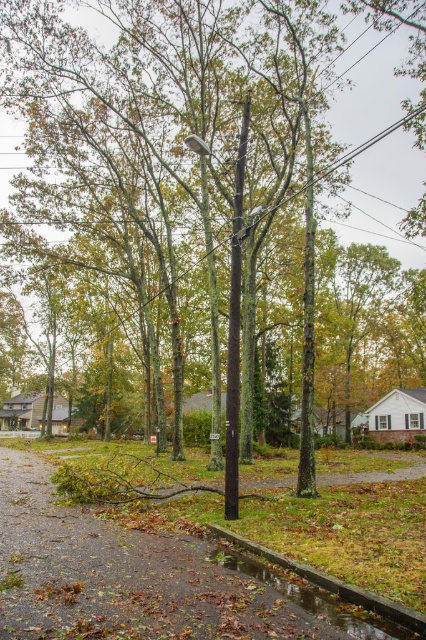
Is shiny reflective puddle at lower center bigger than metallic rectangular sign at center?

Actually, shiny reflective puddle at lower center might be smaller than metallic rectangular sign at center.

Does point (284, 595) come farther from viewer compared to point (215, 435)?

No.

Does point (308, 602) come closer to viewer compared to point (213, 436)?

Yes, point (308, 602) is closer to viewer.

Find the location of a particular element. This screenshot has width=426, height=640. shiny reflective puddle at lower center is located at coordinates (313, 596).